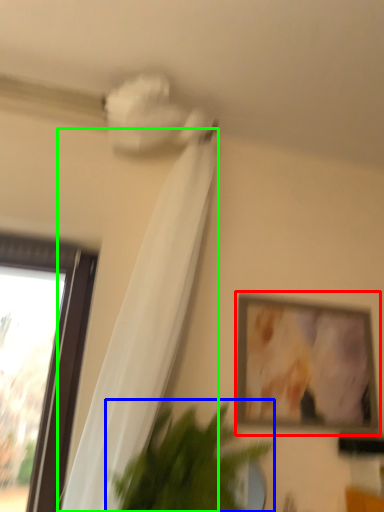
Question: Which object is positioned farthest from picture frame (highlighted by a red box)? Select from houseplant (highlighted by a blue box) and curtain (highlighted by a green box).

Choices:
 (A) houseplant
 (B) curtain

Answer: (B)